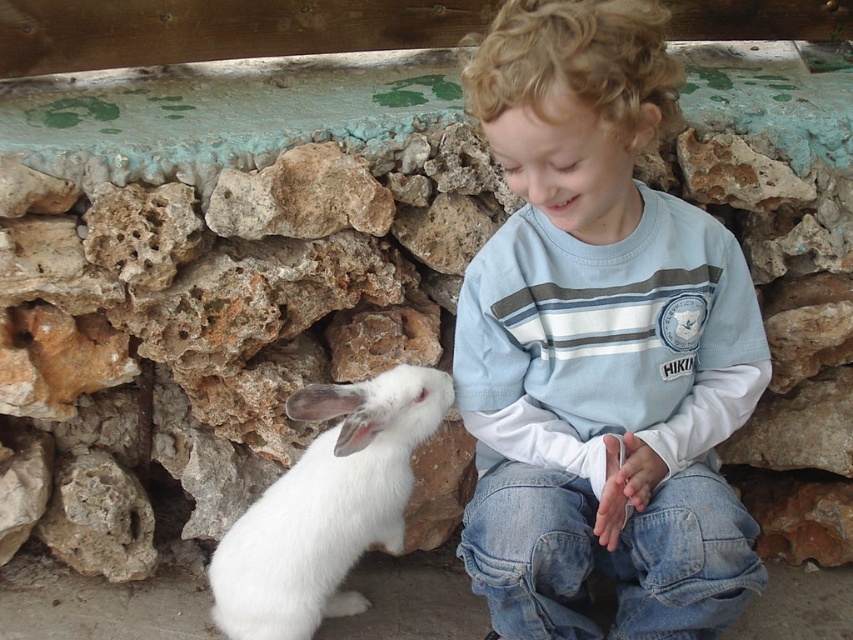
You are a photographer trying to capture the child and the rabbit in a single shot. Since the light blue cotton shirt at center is above the white fluffy rabbit at left, where should you position the camera relative to the child to ensure both are in frame?

Position the camera below the child so that the light blue cotton shirt at center is above the white fluffy rabbit at left, ensuring both are visible in the frame.

Where is the light blue cotton shirt at center located in the image?

The light blue cotton shirt at center is located at point (599, 342) in the image.